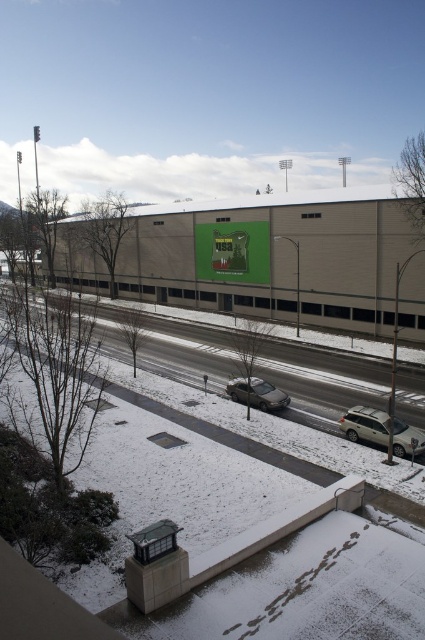
Question: Does snow-covered asphalt highway at lower center appear under satin silver suv at lower right?

Choices:
 (A) no
 (B) yes

Answer: (A)

Question: Among these objects, which one is farthest from the camera?

Choices:
 (A) satin silver sedan at center
 (B) satin silver suv at lower right
 (C) snow-covered asphalt highway at lower center

Answer: (A)

Question: Which of these objects is positioned closest to the satin silver sedan at center?

Choices:
 (A) snow-covered asphalt highway at lower center
 (B) satin silver suv at lower right

Answer: (B)

Question: Which of the following is the closest to the observer?

Choices:
 (A) (399, 429)
 (B) (217, 358)

Answer: (A)

Question: Can you confirm if snow-covered asphalt highway at lower center is positioned to the left of satin silver suv at lower right?

Choices:
 (A) yes
 (B) no

Answer: (A)

Question: Can you confirm if satin silver suv at lower right is thinner than satin silver sedan at center?

Choices:
 (A) yes
 (B) no

Answer: (A)